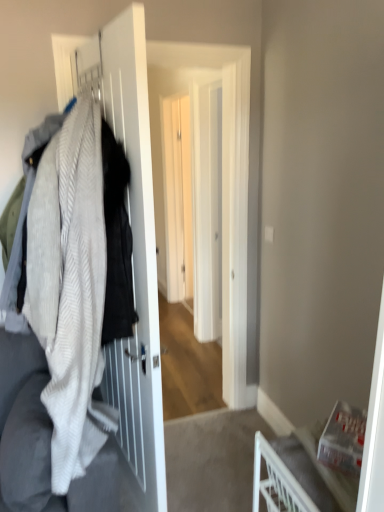
Question: Is white plastic chair at lower right surrounded by white matte screen door at left, which appears as the 2th screen door when viewed from the back?

Choices:
 (A) no
 (B) yes

Answer: (A)

Question: Considering the relative sizes of white matte screen door at left, which appears as the 2th screen door when viewed from the back, and white plastic chair at lower right in the image provided, is white matte screen door at left, which appears as the 2th screen door when viewed from the back, bigger than white plastic chair at lower right?

Choices:
 (A) yes
 (B) no

Answer: (A)

Question: Can you confirm if white matte screen door at left, which appears as the 2th screen door when viewed from the back, is wider than white plastic chair at lower right?

Choices:
 (A) no
 (B) yes

Answer: (A)

Question: Does white matte screen door at left, the first screen door from the front, have a lesser width compared to white plastic chair at lower right?

Choices:
 (A) no
 (B) yes

Answer: (B)

Question: From a real-world perspective, is white matte screen door at left, which appears as the 2th screen door when viewed from the back, on white plastic chair at lower right?

Choices:
 (A) yes
 (B) no

Answer: (A)

Question: Is white matte screen door at left, the first screen door from the front, at the left side of white plastic chair at lower right?

Choices:
 (A) no
 (B) yes

Answer: (B)

Question: Is white plastic chair at lower right next to textured wool sweater at left?

Choices:
 (A) yes
 (B) no

Answer: (B)

Question: Is white plastic chair at lower right thinner than textured wool sweater at left?

Choices:
 (A) yes
 (B) no

Answer: (B)

Question: Is white plastic chair at lower right further to the viewer compared to textured wool sweater at left?

Choices:
 (A) no
 (B) yes

Answer: (B)

Question: Can you confirm if white plastic chair at lower right is positioned to the left of textured wool sweater at left?

Choices:
 (A) yes
 (B) no

Answer: (B)

Question: Does white plastic chair at lower right appear on the right side of textured wool sweater at left?

Choices:
 (A) yes
 (B) no

Answer: (A)

Question: Is white plastic chair at lower right outside textured wool sweater at left?

Choices:
 (A) yes
 (B) no

Answer: (A)

Question: From the image's perspective, is white textured blanket at left beneath white glossy screen door at center, which is the 2th screen door in front-to-back order?

Choices:
 (A) yes
 (B) no

Answer: (A)